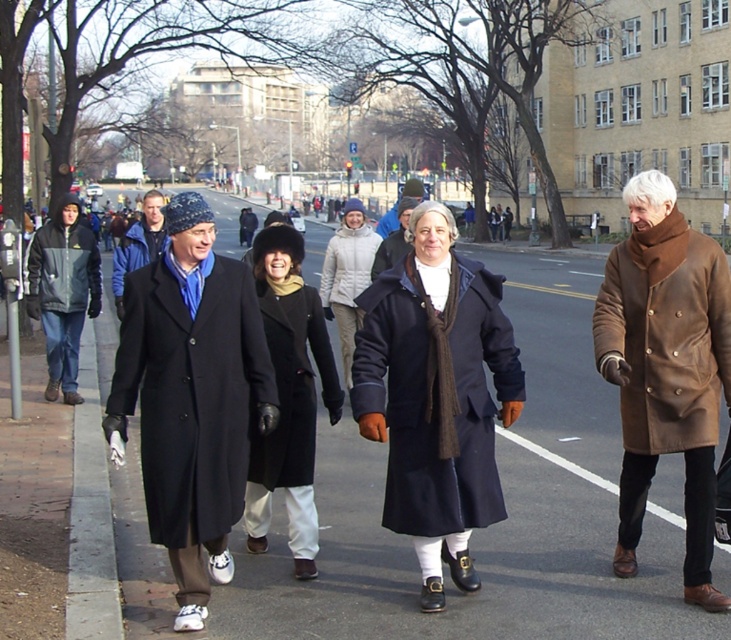
Question: Which of the following is the farthest from the observer?

Choices:
 (A) (423, 358)
 (B) (662, 352)
 (C) (363, 477)
 (D) (341, 228)

Answer: (D)

Question: Which object appears farthest from the camera in this image?

Choices:
 (A) brown leather coat at right
 (B) white puffy coat at center
 (C) gray asphalt at center

Answer: (B)

Question: Where is navy wool coat at center located in relation to gray fleece jacket at left in the image?

Choices:
 (A) above
 (B) below

Answer: (B)

Question: Can you confirm if matte black coat at left is bigger than white puffy coat at center?

Choices:
 (A) yes
 (B) no

Answer: (B)

Question: Among these objects, which one is farthest from the camera?

Choices:
 (A) black woolen coat at center
 (B) matte black coat at left
 (C) brown leather coat at right

Answer: (B)

Question: Does gray fleece jacket at left lie behind white puffy coat at center?

Choices:
 (A) no
 (B) yes

Answer: (B)